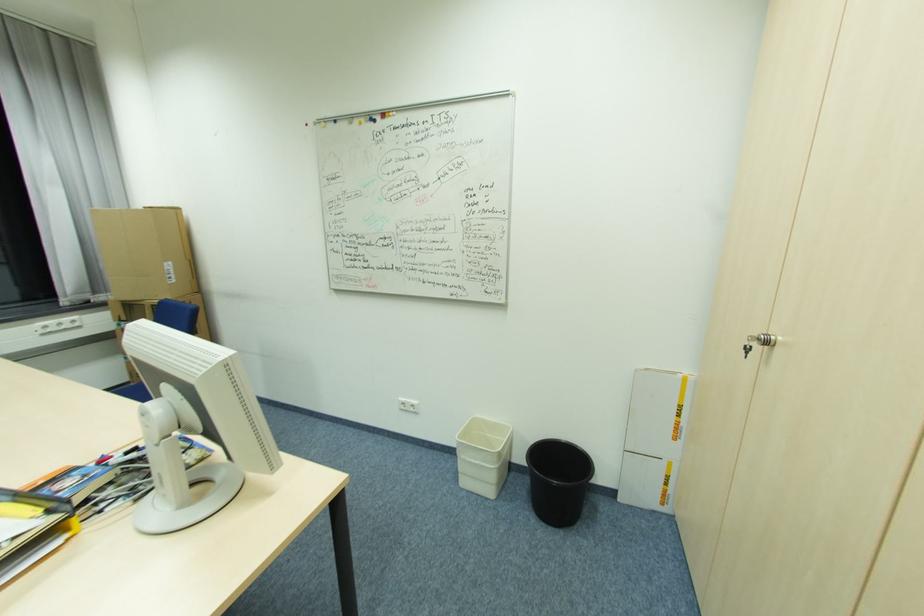
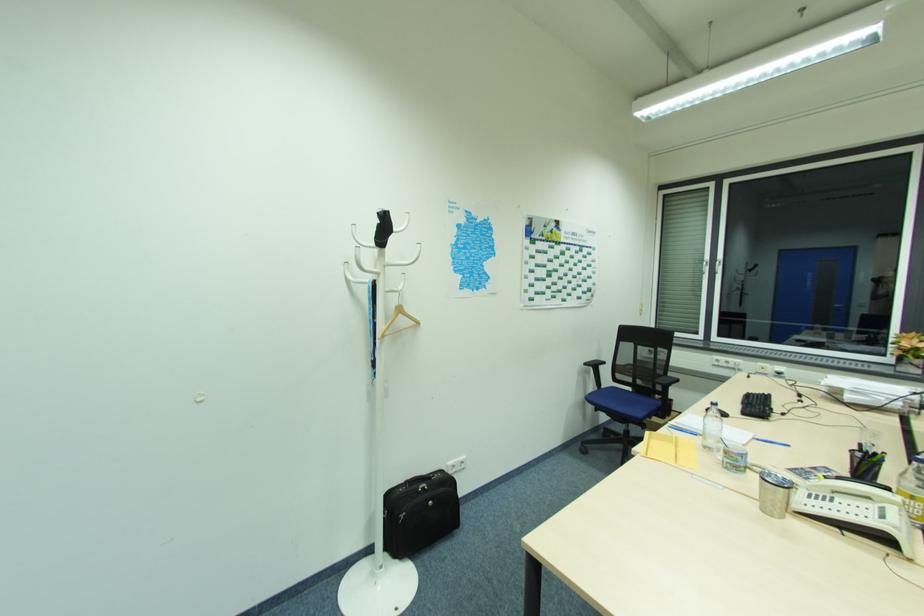
Question: Based on the continuous images, in which direction is the camera rotating? Reply with the corresponding letter.

Choices:
 (A) Left
 (B) Right
 (C) Up
 (D) Down

Answer: (A)